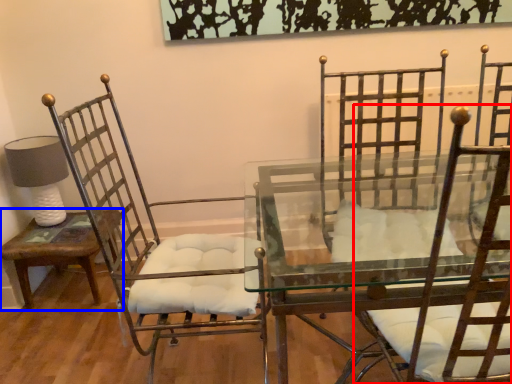
Question: Which object appears farthest to the camera in this image, chair (highlighted by a red box) or table (highlighted by a blue box)?

Choices:
 (A) chair
 (B) table

Answer: (B)